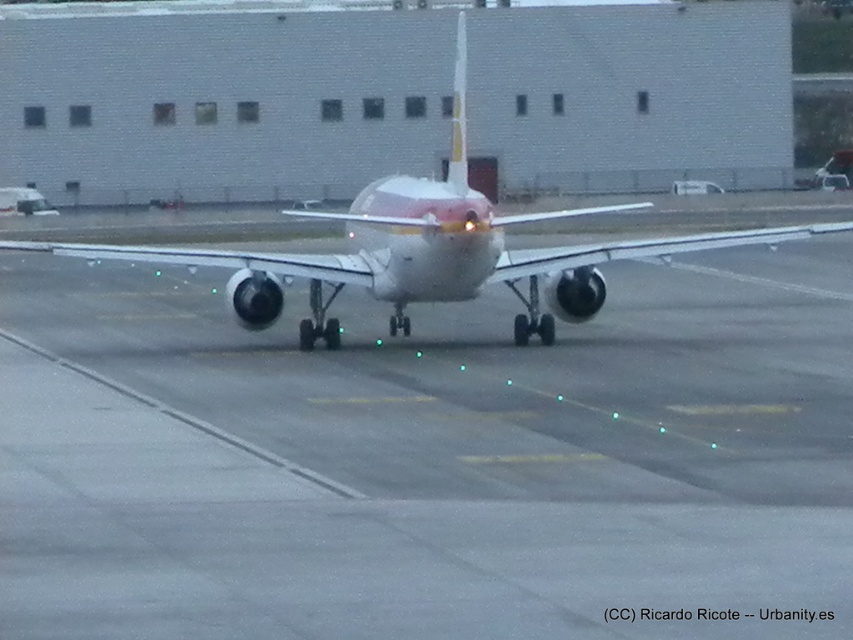
Question: Does gray asphalt runway at center have a greater width compared to white glossy airplane at center?

Choices:
 (A) yes
 (B) no

Answer: (A)

Question: Is gray asphalt runway at center below white glossy airplane at center?

Choices:
 (A) no
 (B) yes

Answer: (B)

Question: Which of the following is the closest to the observer?

Choices:
 (A) (546, 529)
 (B) (403, 176)

Answer: (A)

Question: Does gray asphalt runway at center appear on the left side of white glossy airplane at center?

Choices:
 (A) yes
 (B) no

Answer: (B)

Question: Which of the following is the closest to the observer?

Choices:
 (A) 90,564
 (B) 437,260

Answer: (A)